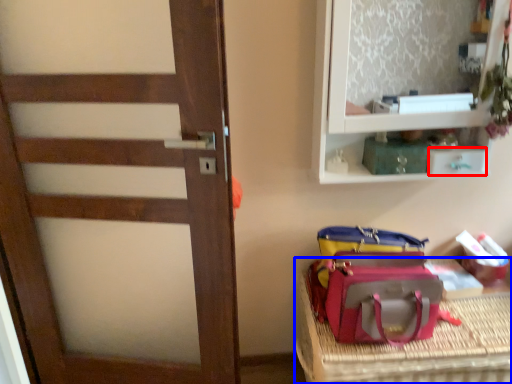
Question: Which of the following is the farthest to the observer, drawer (highlighted by a red box) or furniture (highlighted by a blue box)?

Choices:
 (A) drawer
 (B) furniture

Answer: (A)